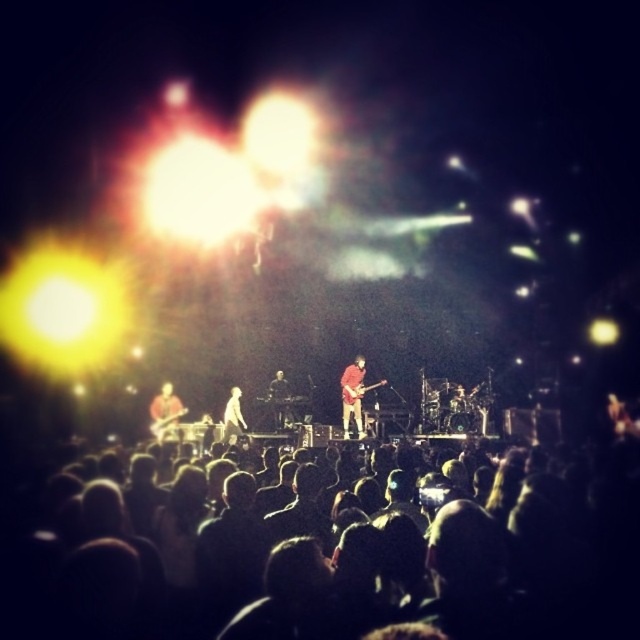
Is dark matte crowd at lower center shorter than smooth black guitar at center?

Correct, dark matte crowd at lower center is not as tall as smooth black guitar at center.

Consider the image. Is dark matte crowd at lower center positioned behind smooth black guitar at center?

No.

Who is more distant from viewer, (397,512) or (284,385)?

Point (284,385)

The height and width of the screenshot is (640, 640). I want to click on dark matte crowd at lower center, so click(x=352, y=566).

Can you confirm if red fabric guitar at center is taller than white fabric at center?

Yes, red fabric guitar at center is taller than white fabric at center.

Does red fabric guitar at center appear on the left side of white fabric at center?

In fact, red fabric guitar at center is to the right of white fabric at center.

Is point (358, 376) positioned after point (230, 422)?

Yes, it is behind point (230, 422).

Identify the location of red fabric guitar at center. The width and height of the screenshot is (640, 640). (353, 396).

Based on the photo, who is shorter, red fabric guitar at center or matte black guitar at center?

matte black guitar at center is shorter.

Is point (346, 404) less distant than point (164, 429)?

No, (346, 404) is further to viewer.

Where is `red fabric guitar at center`? This screenshot has height=640, width=640. red fabric guitar at center is located at coordinates (353, 396).